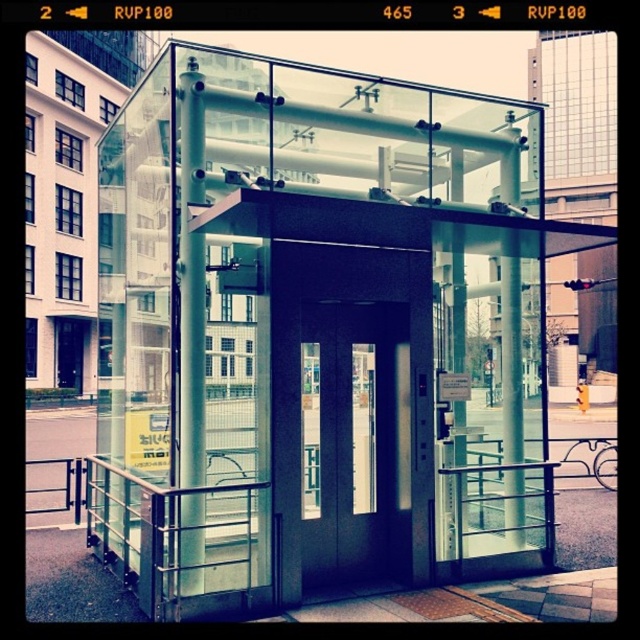
Can you confirm if transparent glass elevator at center is positioned to the left of metallic silver pole at center?

Incorrect, transparent glass elevator at center is not on the left side of metallic silver pole at center.

Can you confirm if transparent glass elevator at center is positioned above metallic silver pole at center?

Incorrect, transparent glass elevator at center is not positioned above metallic silver pole at center.

Describe the element at coordinates (314, 332) in the screenshot. I see `transparent glass elevator at center` at that location.

Where is `transparent glass elevator at center`? Image resolution: width=640 pixels, height=640 pixels. transparent glass elevator at center is located at coordinates (314, 332).

Which is more to the right, transparent glass door at center or clear glass pillar at center?

Positioned to the right is clear glass pillar at center.

Who is positioned more to the left, transparent glass door at center or clear glass pillar at center?

Positioned to the left is transparent glass door at center.

Between point (352, 301) and point (522, 480), which one is positioned behind?

The point (522, 480) is behind.

Find the location of a particular element. transparent glass door at center is located at coordinates (x=355, y=444).

Between point (195, 186) and point (518, 516), which one is positioned in front?

Point (195, 186) is more forward.

Measure the distance between metallic silver pole at center and clear glass pillar at center.

A distance of 2.68 meters exists between metallic silver pole at center and clear glass pillar at center.

The height and width of the screenshot is (640, 640). What do you see at coordinates (192, 280) in the screenshot?
I see `metallic silver pole at center` at bounding box center [192, 280].

This screenshot has height=640, width=640. What are the coordinates of `metallic silver pole at center` in the screenshot? It's located at (192, 280).